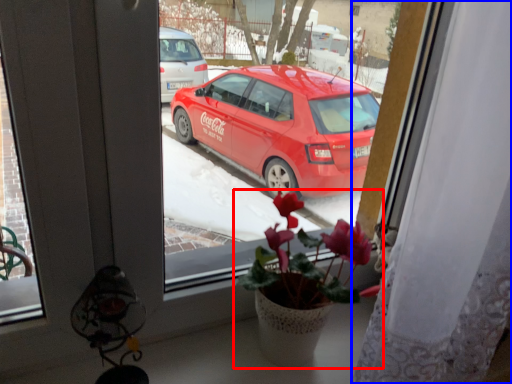
Question: Which of the following is the farthest to the observer, houseplant (highlighted by a red box) or curtain (highlighted by a blue box)?

Choices:
 (A) houseplant
 (B) curtain

Answer: (A)